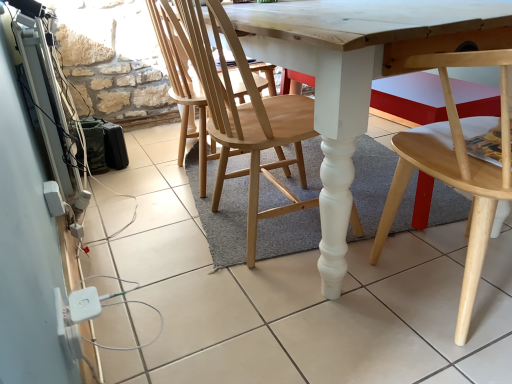
The width and height of the screenshot is (512, 384). Find the location of `vacant space that is to the left of natural wood chair at center, marked as the 1th chair in a left-to-right arrangement`. vacant space that is to the left of natural wood chair at center, marked as the 1th chair in a left-to-right arrangement is located at coordinates (158, 230).